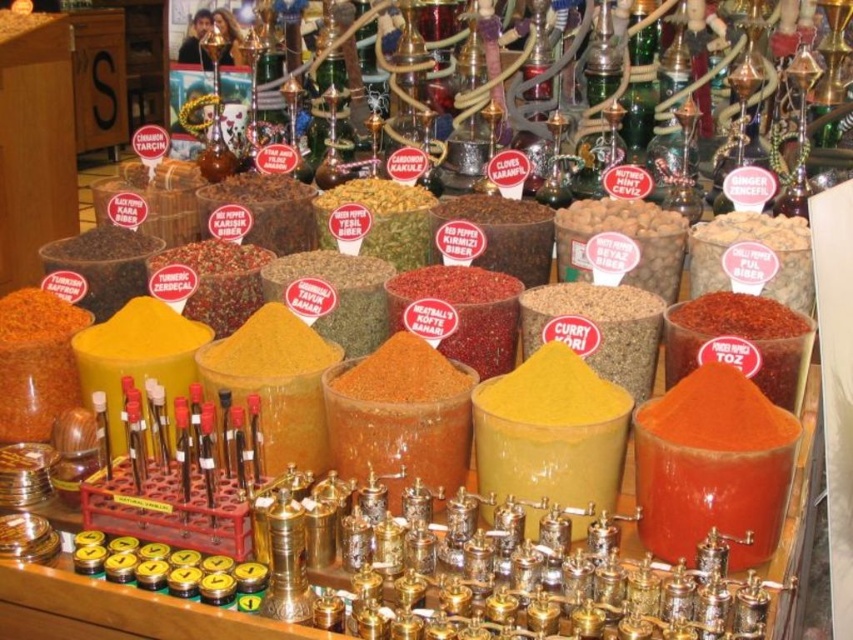
Can you confirm if brown granular curry at center is positioned above bright red powder at center?

No.

Who is more forward, (648, 372) or (715, 284)?

Point (648, 372)

Where is `brown granular curry at center`? Image resolution: width=853 pixels, height=640 pixels. brown granular curry at center is located at coordinates point(596,328).

From the picture: Who is taller, dark red pepper at center or yellow powder at center?

dark red pepper at center

Does dark red pepper at center lie in front of yellow powder at center?

No, it is not.

Image resolution: width=853 pixels, height=640 pixels. Find the location of `dark red pepper at center`. dark red pepper at center is located at coordinates (505, 234).

Locate an element on the screen. dark red pepper at center is located at coordinates (505, 234).

Is bright red powder at center to the right of dark red pepper at center from the viewer's perspective?

Indeed, bright red powder at center is positioned on the right side of dark red pepper at center.

Does bright red powder at center have a smaller size compared to dark red pepper at center?

Yes, bright red powder at center is smaller than dark red pepper at center.

Image resolution: width=853 pixels, height=640 pixels. In order to click on bright red powder at center in this screenshot , I will do `click(753, 241)`.